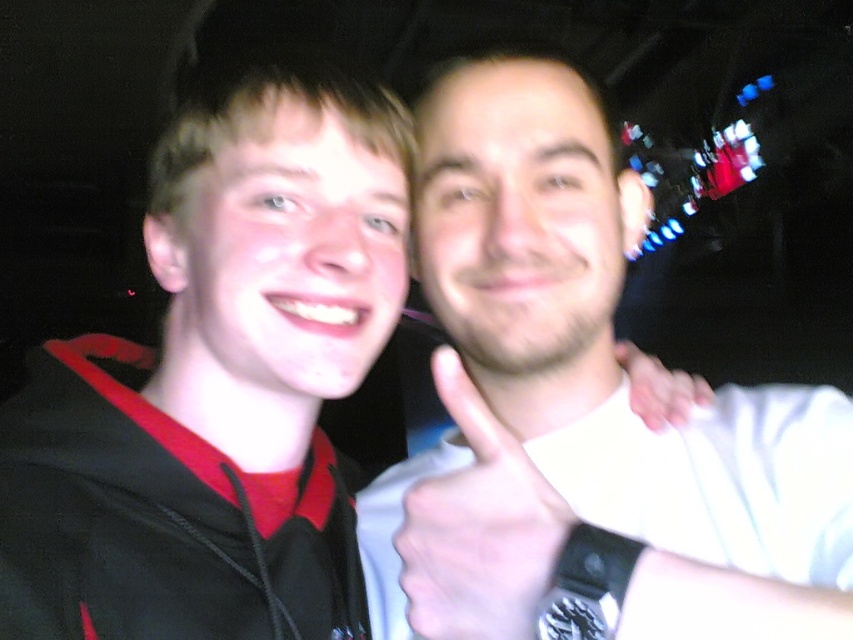
Which is behind, point (831, 561) or point (479, 570)?

Point (831, 561)

Which is below, white matte shirt at upper right or white matte hand at center?

white matte shirt at upper right

Where is `white matte shirt at upper right`? The image size is (853, 640). white matte shirt at upper right is located at coordinates (582, 404).

What are the coordinates of `white matte hand at center` in the screenshot? It's located at (479, 529).

Does white matte hand at center have a lesser height compared to white matte hand at upper right?

In fact, white matte hand at center may be taller than white matte hand at upper right.

What do you see at coordinates (479, 529) in the screenshot? Image resolution: width=853 pixels, height=640 pixels. I see `white matte hand at center` at bounding box center [479, 529].

The width and height of the screenshot is (853, 640). I want to click on white matte hand at center, so click(479, 529).

Is white matte shirt at upper right positioned before white matte hand at upper right?

Yes, white matte shirt at upper right is in front of white matte hand at upper right.

Who is more distant from viewer, (733,461) or (675,417)?

The point (675,417) is behind.

This screenshot has width=853, height=640. I want to click on white matte shirt at upper right, so click(582, 404).